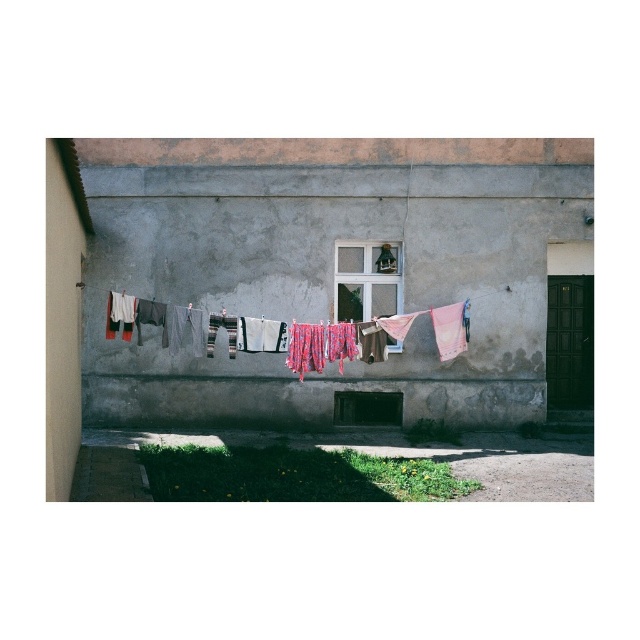
You are a painter standing on a ladder near the wall. You need to paint the clear glass window at center without getting paint on the multicolored fabric at center. Is the fabric below or above the window?

The multicolored fabric at center is positioned under the clear glass window at center, so it is below the window. To avoid getting paint on the fabric, ensure that paint does not drip downward from the window onto the fabric below.

You are standing in front of the weathered gray wall with the multicolored fabric at center and the clear glass window at center. Which object is shorter in height?

The multicolored fabric at center has a lesser height compared to the clear glass window at center, so the multicolored fabric at center is shorter in height.